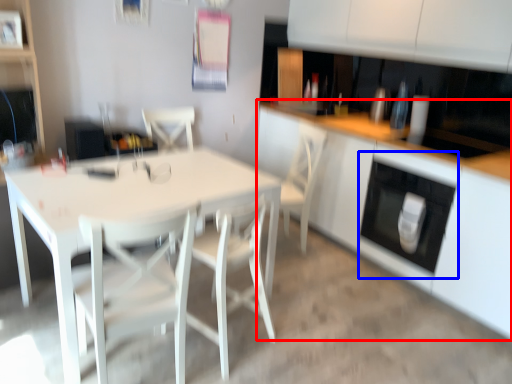
Question: Which point is further to the camera, cabinetry (highlighted by a red box) or oven (highlighted by a blue box)?

Choices:
 (A) cabinetry
 (B) oven

Answer: (B)